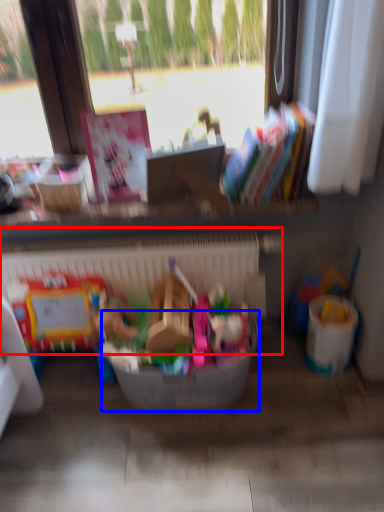
Question: Which object is further to the camera taking this photo, radiator (highlighted by a red box) or basket (highlighted by a blue box)?

Choices:
 (A) radiator
 (B) basket

Answer: (A)